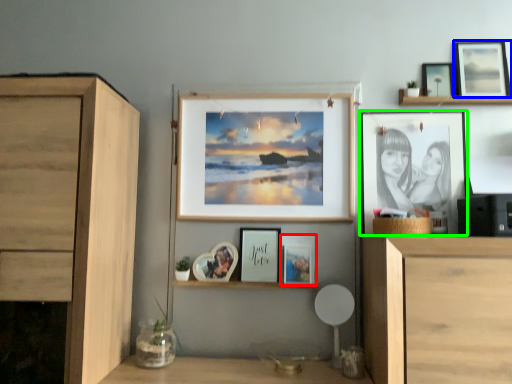
Question: Considering the real-world distances, which object is farthest from picture frame (highlighted by a red box)? picture frame (highlighted by a blue box) or picture frame (highlighted by a green box)?

Choices:
 (A) picture frame
 (B) picture frame

Answer: (A)